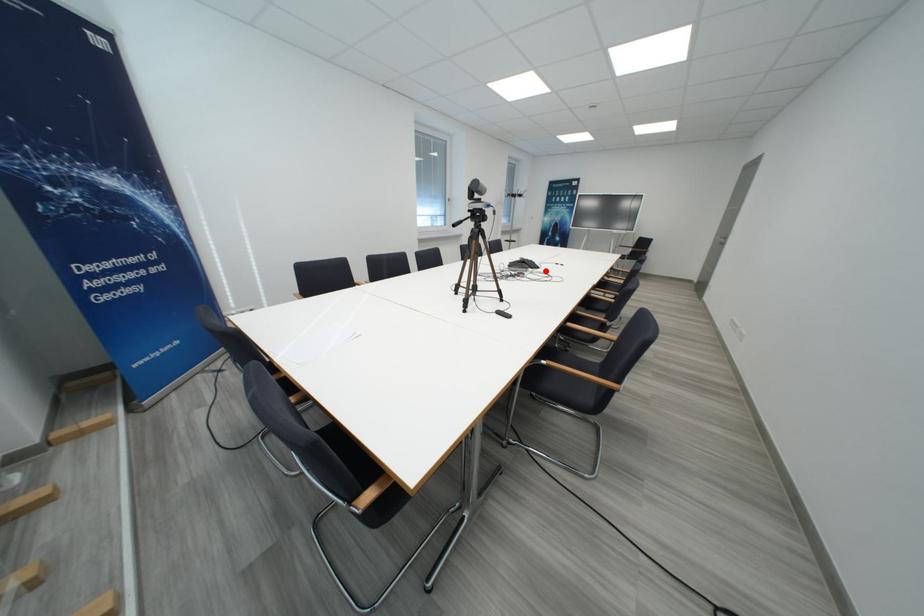
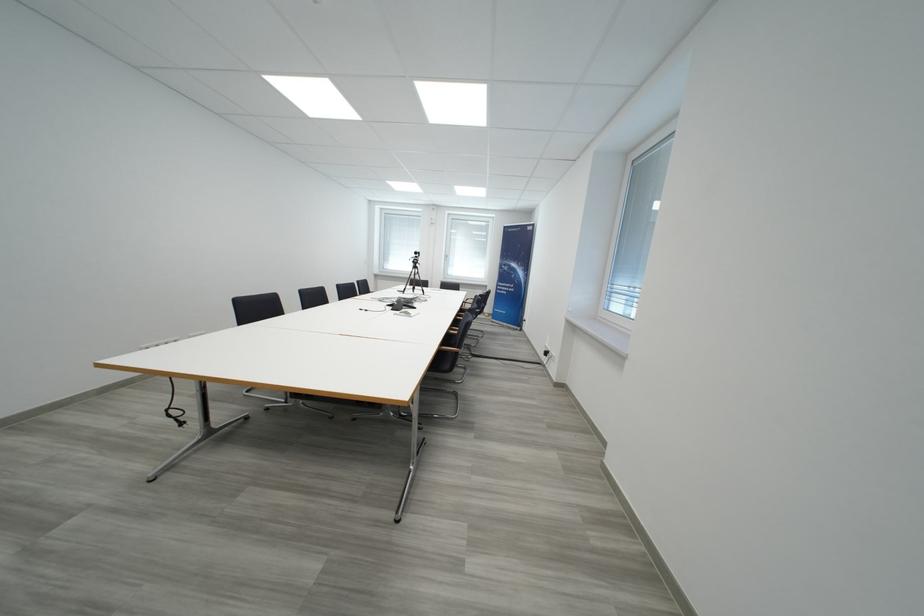
Find the pixel in the second image that matches the highlighted location in the first image.

(395, 309)